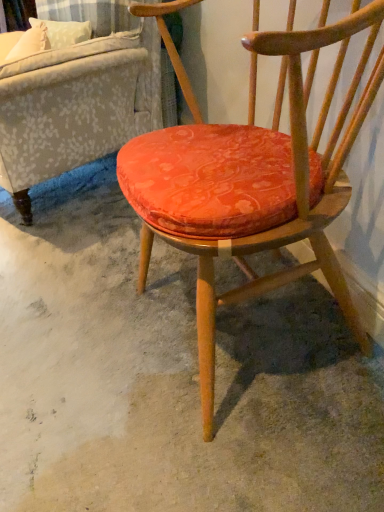
Question: Visually, is orange fabric cushion at center positioned to the left or to the right of velvet orange cushion at center?

Choices:
 (A) left
 (B) right

Answer: (A)

Question: In the image, is orange fabric cushion at center positioned in front of or behind velvet orange cushion at center?

Choices:
 (A) front
 (B) behind

Answer: (B)

Question: Which object is positioned farthest from the textured gray fabric couch at upper left?

Choices:
 (A) velvet orange cushion at center
 (B) orange fabric cushion at center

Answer: (A)

Question: Which is farther from the velvet orange cushion at center?

Choices:
 (A) orange fabric cushion at center
 (B) textured gray fabric couch at upper left

Answer: (B)